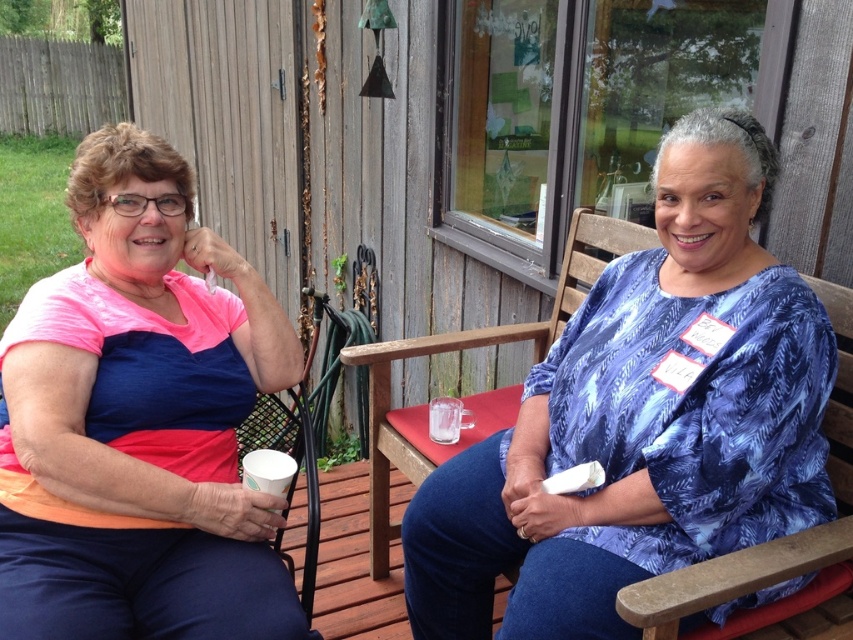
You are standing at the origin point of the image. The wooden chair at right is located at coordinates point (730, 577). If you want to walk towards the wooden chair at right, in which direction should you move?

The wooden chair at right is located at coordinates point (730, 577). Since the coordinate system typically has the origin at the bottom left corner, moving towards higher x and y values would mean moving to the right and upwards. Therefore, to reach the wooden chair at right, you should move to the right and upwards from your current position at the origin.

You are a photographer setting up for a portrait. You need to position a reflector between the wooden chair at right and the white paper cup at lower left. Based on their positions, where should you place the reflector?

The wooden chair at right is to the right of the white paper cup at lower left, so you should place the reflector to the right of the white paper cup at lower left but left of the wooden chair at right to position it between them.

You are a person who needs to place a 12 inch wide book on the table between the wooden chair at center and the white paper cup at lower left. Can you fit the book there without moving either object?

The wooden chair at center and white paper cup at lower left are 28.44 inches apart from each other. Since the book is only 12 inches wide, there is enough space between them to place the book without moving either object.